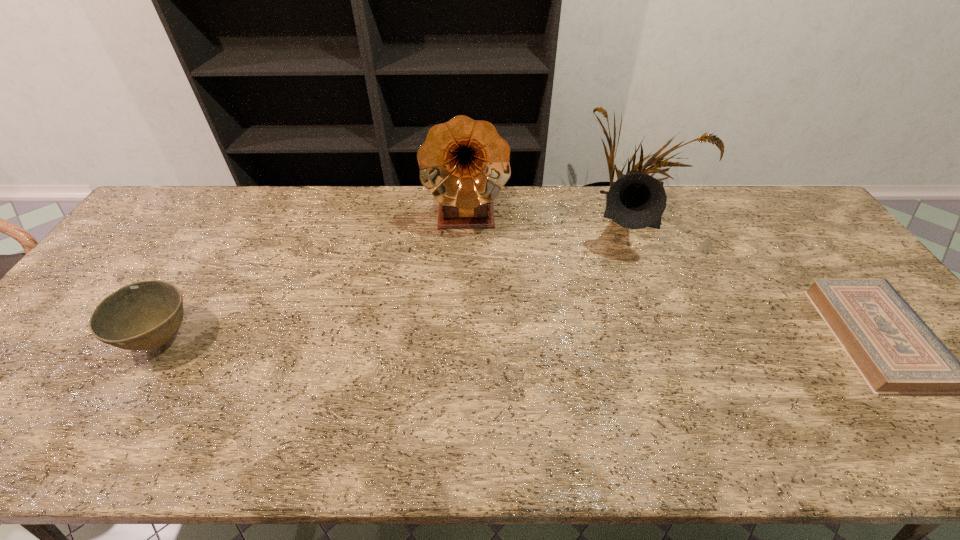
In order to click on the leftmost object in this screenshot , I will do `click(145, 315)`.

You are a GUI agent. You are given a task and a screenshot of the screen. Output one action in this format:
    pyautogui.click(x=<x>, y=<y>)
    Task: Click on the bowl
    The width and height of the screenshot is (960, 540).
    Given the screenshot: What is the action you would take?
    pyautogui.click(x=145, y=315)

Identify the location of the second object from right to left. (635, 201).

This screenshot has height=540, width=960. I want to click on the shorter phonograph_record, so click(635, 201).

You are a GUI agent. You are given a task and a screenshot of the screen. Output one action in this format:
    pyautogui.click(x=<x>, y=<y>)
    Task: Click on the left phonograph_record
    The image size is (960, 540).
    Given the screenshot: What is the action you would take?
    pyautogui.click(x=464, y=163)

Identify the location of the taller phonograph_record. [464, 163].

Find the location of a particular element. This screenshot has height=540, width=960. vacant space located 0.190m on the back of the leftmost object is located at coordinates (209, 261).

Where is `vacant region located 0.120m from the horn of the second object from right to left`? This screenshot has height=540, width=960. vacant region located 0.120m from the horn of the second object from right to left is located at coordinates point(624,291).

The height and width of the screenshot is (540, 960). I want to click on vacant region located 0.150m from the horn of the second object from right to left, so click(x=622, y=299).

Where is `vacant region located from the horn of the second object from right to left`? This screenshot has height=540, width=960. vacant region located from the horn of the second object from right to left is located at coordinates (619, 315).